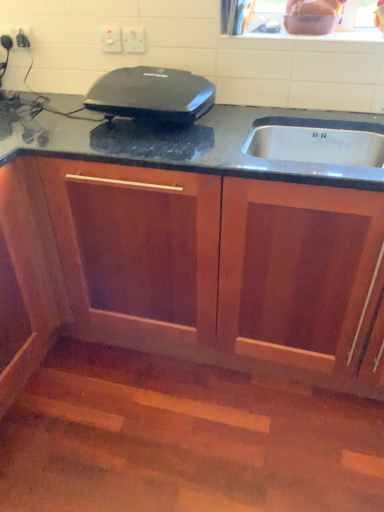
Question: From a real-world perspective, does black glossy waffle maker at center sit lower than white plastic electric outlet at upper center, the first electric outlet from the left?

Choices:
 (A) no
 (B) yes

Answer: (B)

Question: Does black glossy waffle maker at center lie in front of white plastic electric outlet at upper center, which is the 2th electric outlet in right-to-left order?

Choices:
 (A) yes
 (B) no

Answer: (A)

Question: Is black glossy waffle maker at center not within white plastic electric outlet at upper center, the first electric outlet from the left?

Choices:
 (A) yes
 (B) no

Answer: (A)

Question: Can you confirm if black glossy waffle maker at center is positioned to the left of white plastic electric outlet at upper center, the first electric outlet from the left?

Choices:
 (A) yes
 (B) no

Answer: (B)

Question: Is black glossy waffle maker at center shorter than white plastic electric outlet at upper center, which is the 2th electric outlet in right-to-left order?

Choices:
 (A) yes
 (B) no

Answer: (B)

Question: Does black glossy waffle maker at center have a greater width compared to white plastic electric outlet at upper center, the first electric outlet from the left?

Choices:
 (A) no
 (B) yes

Answer: (B)

Question: Is white plastic electric outlet at upper center, placed as the first electric outlet when sorted from right to left, completely or partially outside of black glossy waffle maker at center?

Choices:
 (A) yes
 (B) no

Answer: (A)

Question: Is there a large distance between white plastic electric outlet at upper center, acting as the 2th electric outlet starting from the left, and black glossy waffle maker at center?

Choices:
 (A) yes
 (B) no

Answer: (B)

Question: Considering the relative positions of white plastic electric outlet at upper center, placed as the first electric outlet when sorted from right to left, and black glossy waffle maker at center in the image provided, is white plastic electric outlet at upper center, placed as the first electric outlet when sorted from right to left, in front of black glossy waffle maker at center?

Choices:
 (A) no
 (B) yes

Answer: (A)

Question: Is the depth of white plastic electric outlet at upper center, acting as the 2th electric outlet starting from the left, greater than that of black glossy waffle maker at center?

Choices:
 (A) yes
 (B) no

Answer: (A)

Question: Can you confirm if white plastic electric outlet at upper center, acting as the 2th electric outlet starting from the left, is taller than black glossy waffle maker at center?

Choices:
 (A) yes
 (B) no

Answer: (B)

Question: From the image's perspective, is white plastic electric outlet at upper center, acting as the 2th electric outlet starting from the left, located beneath black glossy waffle maker at center?

Choices:
 (A) no
 (B) yes

Answer: (A)

Question: Does wooden cabinet at center lie behind black glossy waffle maker at center?

Choices:
 (A) yes
 (B) no

Answer: (B)